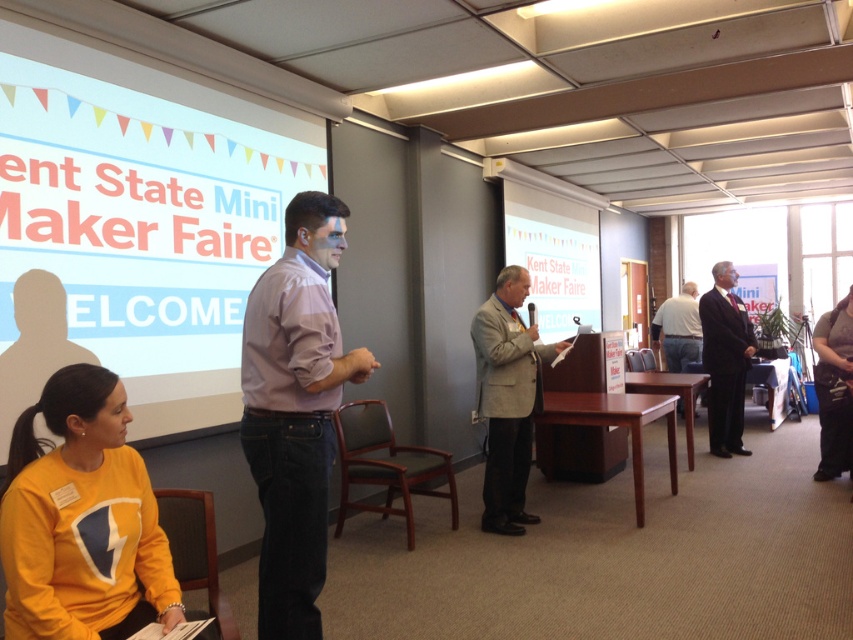
Between yellow cotton sweatshirt at lower left and striped cotton shirt at center, which one has less height?

Standing shorter between the two is yellow cotton sweatshirt at lower left.

In the scene shown: Which is more to the left, yellow cotton sweatshirt at lower left or striped cotton shirt at center?

yellow cotton sweatshirt at lower left is more to the left.

Who is more forward, (64, 579) or (289, 538)?

Point (64, 579)

Image resolution: width=853 pixels, height=640 pixels. I want to click on yellow cotton sweatshirt at lower left, so click(82, 518).

Looking at this image, is striped cotton shirt at center wider than dark gray suit at right?

No.

Between striped cotton shirt at center and dark gray suit at right, which one has more height?

dark gray suit at right

Between point (283, 236) and point (733, 310), which one is positioned in front?

Positioned in front is point (283, 236).

Locate an element on the screen. The width and height of the screenshot is (853, 640). striped cotton shirt at center is located at coordinates (294, 410).

Is point (572, 227) positioned behind point (677, 307)?

No, (572, 227) is closer to viewer.

Image resolution: width=853 pixels, height=640 pixels. Describe the element at coordinates (554, 257) in the screenshot. I see `white matte projection screen at center` at that location.

This screenshot has height=640, width=853. What are the coordinates of `white matte projection screen at center` in the screenshot? It's located at (554, 257).